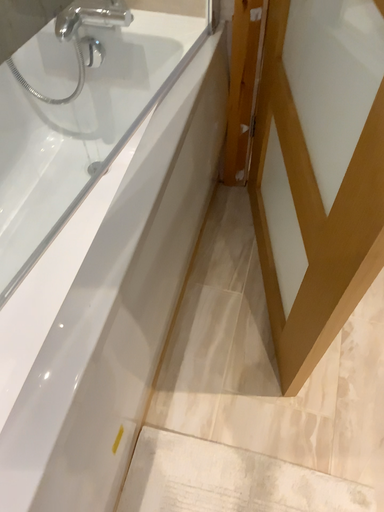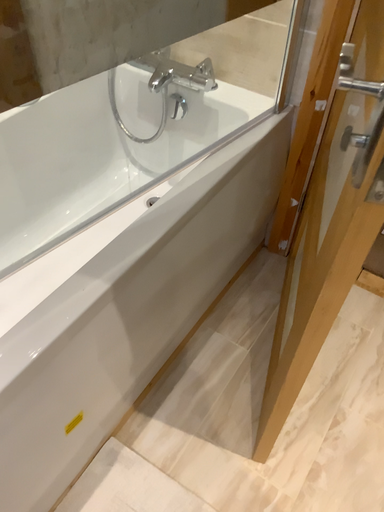
Question: How did the camera likely rotate when shooting the video?

Choices:
 (A) rotated right
 (B) rotated left

Answer: (B)